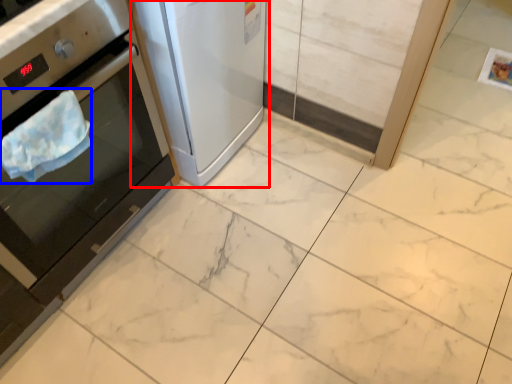
Question: Which object is closer to the camera taking this photo, home appliance (highlighted by a red box) or blanket (highlighted by a blue box)?

Choices:
 (A) home appliance
 (B) blanket

Answer: (B)